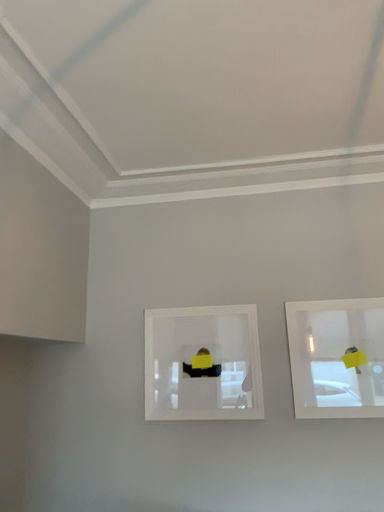
This screenshot has height=512, width=384. What do you see at coordinates (337, 357) in the screenshot? I see `clear glass picture frame at upper right, the first picture frame from the right` at bounding box center [337, 357].

I want to click on clear glass picture frame at upper right, the first picture frame from the right, so click(x=337, y=357).

The width and height of the screenshot is (384, 512). Describe the element at coordinates (202, 362) in the screenshot. I see `clear plastic picture frame at center, marked as the first picture frame in a left-to-right arrangement` at that location.

Measure the distance between clear plastic picture frame at center, marked as the first picture frame in a left-to-right arrangement, and camera.

clear plastic picture frame at center, marked as the first picture frame in a left-to-right arrangement, and camera are 8.28 feet apart from each other.

In order to face clear plastic picture frame at center, marked as the first picture frame in a left-to-right arrangement, should I rotate leftwards or rightwards?

To face it directly, rotate right by 1.464 degrees.

I want to click on clear plastic picture frame at center, marked as the first picture frame in a left-to-right arrangement, so click(x=202, y=362).

Find the location of a particular element. Image resolution: width=384 pixels, height=512 pixels. clear glass picture frame at upper right, placed as the 2th picture frame when sorted from left to right is located at coordinates (337, 357).

Is clear glass picture frame at upper right, the first picture frame from the right, to the right of clear plastic picture frame at center, marked as the first picture frame in a left-to-right arrangement, from the viewer's perspective?

Correct, you'll find clear glass picture frame at upper right, the first picture frame from the right, to the right of clear plastic picture frame at center, marked as the first picture frame in a left-to-right arrangement.

Who is more distant, clear glass picture frame at upper right, the first picture frame from the right, or clear plastic picture frame at center, marked as the first picture frame in a left-to-right arrangement?

clear plastic picture frame at center, marked as the first picture frame in a left-to-right arrangement, is behind.

Which is behind, point (375, 316) or point (165, 368)?

Point (165, 368)

From the image's perspective, is clear glass picture frame at upper right, placed as the 2th picture frame when sorted from left to right, located above clear plastic picture frame at center, marked as the first picture frame in a left-to-right arrangement?

Yes, from the image's perspective, clear glass picture frame at upper right, placed as the 2th picture frame when sorted from left to right, is above clear plastic picture frame at center, marked as the first picture frame in a left-to-right arrangement.

From a real-world perspective, is clear glass picture frame at upper right, the first picture frame from the right, above or below clear plastic picture frame at center, marked as the first picture frame in a left-to-right arrangement?

In terms of real-world spatial position, clear glass picture frame at upper right, the first picture frame from the right, is above clear plastic picture frame at center, marked as the first picture frame in a left-to-right arrangement.

Considering the sizes of objects clear glass picture frame at upper right, the first picture frame from the right, and clear plastic picture frame at center, marked as the first picture frame in a left-to-right arrangement, in the image provided, who is wider, clear glass picture frame at upper right, the first picture frame from the right, or clear plastic picture frame at center, marked as the first picture frame in a left-to-right arrangement,?

clear glass picture frame at upper right, the first picture frame from the right.

Which of these two, clear glass picture frame at upper right, placed as the 2th picture frame when sorted from left to right, or clear plastic picture frame at center, marked as the first picture frame in a left-to-right arrangement, stands shorter?

clear plastic picture frame at center, marked as the first picture frame in a left-to-right arrangement.

Looking at the image, does clear glass picture frame at upper right, the first picture frame from the right, seem bigger or smaller compared to clear plastic picture frame at center, marked as the first picture frame in a left-to-right arrangement?

Clearly, clear glass picture frame at upper right, the first picture frame from the right, is smaller in size than clear plastic picture frame at center, marked as the first picture frame in a left-to-right arrangement.

Choose the correct answer: Is clear glass picture frame at upper right, the first picture frame from the right, inside clear plastic picture frame at center, marked as the first picture frame in a left-to-right arrangement, or outside it?

clear glass picture frame at upper right, the first picture frame from the right, is located beyond the bounds of clear plastic picture frame at center, marked as the first picture frame in a left-to-right arrangement.

Would you consider clear glass picture frame at upper right, the first picture frame from the right, to be distant from clear plastic picture frame at center, marked as the first picture frame in a left-to-right arrangement?

Actually, clear glass picture frame at upper right, the first picture frame from the right, and clear plastic picture frame at center, marked as the first picture frame in a left-to-right arrangement, are a little close together.

In the scene shown: Does clear glass picture frame at upper right, placed as the 2th picture frame when sorted from left to right, turn towards clear plastic picture frame at center, marked as the first picture frame in a left-to-right arrangement?

No, clear glass picture frame at upper right, placed as the 2th picture frame when sorted from left to right, is not aimed at clear plastic picture frame at center, marked as the first picture frame in a left-to-right arrangement.

How much distance is there between clear glass picture frame at upper right, placed as the 2th picture frame when sorted from left to right, and clear plastic picture frame at center, the 2th picture frame positioned from the right?

The distance of clear glass picture frame at upper right, placed as the 2th picture frame when sorted from left to right, from clear plastic picture frame at center, the 2th picture frame positioned from the right, is 19.85 inches.

Identify the location of picture frame on the left of clear glass picture frame at upper right, placed as the 2th picture frame when sorted from left to right. Image resolution: width=384 pixels, height=512 pixels. (202, 362).

Considering the positions of objects clear plastic picture frame at center, marked as the first picture frame in a left-to-right arrangement, and clear glass picture frame at upper right, placed as the 2th picture frame when sorted from left to right, in the image provided, who is more to the left, clear plastic picture frame at center, marked as the first picture frame in a left-to-right arrangement, or clear glass picture frame at upper right, placed as the 2th picture frame when sorted from left to right,?

clear plastic picture frame at center, marked as the first picture frame in a left-to-right arrangement.

Considering their positions, is clear plastic picture frame at center, the 2th picture frame positioned from the right, located in front of or behind clear glass picture frame at upper right, placed as the 2th picture frame when sorted from left to right?

Visually, clear plastic picture frame at center, the 2th picture frame positioned from the right, is located behind clear glass picture frame at upper right, placed as the 2th picture frame when sorted from left to right.

Does point (167, 314) come closer to viewer compared to point (374, 309)?

No, (167, 314) is further to viewer.

From the image's perspective, is clear plastic picture frame at center, marked as the first picture frame in a left-to-right arrangement, above or below clear glass picture frame at upper right, placed as the 2th picture frame when sorted from left to right?

Based on their image positions, clear plastic picture frame at center, marked as the first picture frame in a left-to-right arrangement, is located beneath clear glass picture frame at upper right, placed as the 2th picture frame when sorted from left to right.

From a real-world perspective, between clear plastic picture frame at center, marked as the first picture frame in a left-to-right arrangement, and clear glass picture frame at upper right, the first picture frame from the right, who is vertically higher?

clear glass picture frame at upper right, the first picture frame from the right.

Which object is thinner, clear plastic picture frame at center, marked as the first picture frame in a left-to-right arrangement, or clear glass picture frame at upper right, the first picture frame from the right?

clear plastic picture frame at center, marked as the first picture frame in a left-to-right arrangement, is thinner.

Does clear plastic picture frame at center, marked as the first picture frame in a left-to-right arrangement, have a greater height compared to clear glass picture frame at upper right, placed as the 2th picture frame when sorted from left to right?

No.

Between clear plastic picture frame at center, the 2th picture frame positioned from the right, and clear glass picture frame at upper right, the first picture frame from the right, which one has larger size?

With larger size is clear plastic picture frame at center, the 2th picture frame positioned from the right.

Looking at this image, which is correct: clear plastic picture frame at center, the 2th picture frame positioned from the right, is inside clear glass picture frame at upper right, placed as the 2th picture frame when sorted from left to right, or outside of it?

The correct answer is: outside.

Is clear plastic picture frame at center, the 2th picture frame positioned from the right, touching clear glass picture frame at upper right, placed as the 2th picture frame when sorted from left to right?

There is a gap between clear plastic picture frame at center, the 2th picture frame positioned from the right, and clear glass picture frame at upper right, placed as the 2th picture frame when sorted from left to right.

Is clear plastic picture frame at center, the 2th picture frame positioned from the right, facing towards clear glass picture frame at upper right, the first picture frame from the right?

No, clear plastic picture frame at center, the 2th picture frame positioned from the right, is not aimed at clear glass picture frame at upper right, the first picture frame from the right.

Where is `picture frame that is in front of the clear plastic picture frame at center, the 2th picture frame positioned from the right`? Image resolution: width=384 pixels, height=512 pixels. picture frame that is in front of the clear plastic picture frame at center, the 2th picture frame positioned from the right is located at coordinates (337, 357).

The width and height of the screenshot is (384, 512). Identify the location of picture frame lying on the right of clear plastic picture frame at center, marked as the first picture frame in a left-to-right arrangement. (337, 357).

I want to click on picture frame above the clear plastic picture frame at center, marked as the first picture frame in a left-to-right arrangement (from the image's perspective), so click(337, 357).